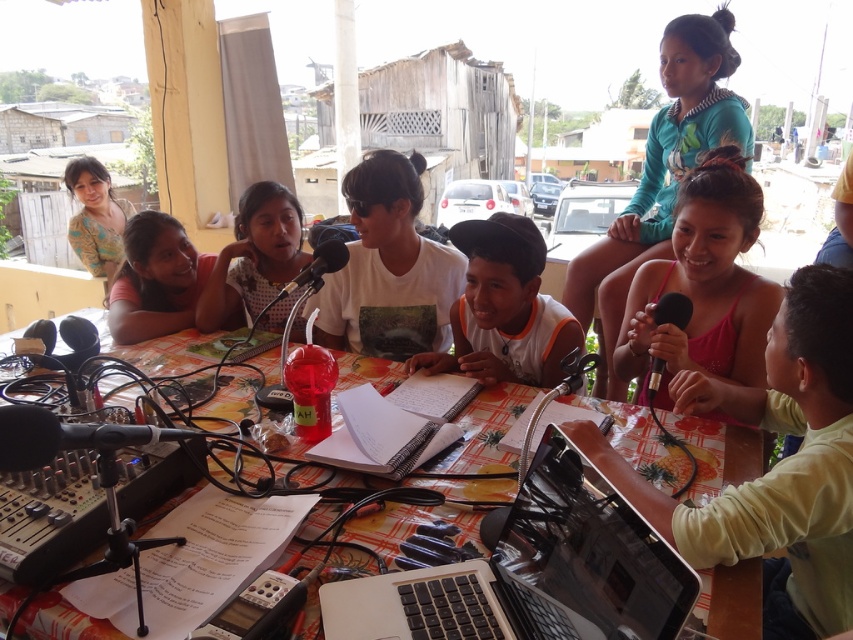
Does green fabric shirt at center appear over black matte microphone at lower left?

Actually, green fabric shirt at center is below black matte microphone at lower left.

Between green fabric shirt at center and black matte microphone at lower left, which one is positioned lower?

Positioned lower is green fabric shirt at center.

Between point (677, 401) and point (9, 460), which one is positioned in front?

Point (9, 460) is more forward.

Locate an element on the screen. The image size is (853, 640). green fabric shirt at center is located at coordinates (775, 465).

Between white matte shirt at center and black metallic microphone at center, which one has less height?

black metallic microphone at center

Can you confirm if white matte shirt at center is shorter than black metallic microphone at center?

No, white matte shirt at center is not shorter than black metallic microphone at center.

Locate an element on the screen. Image resolution: width=853 pixels, height=640 pixels. white matte shirt at center is located at coordinates (387, 268).

Does black matte microphone at lower left appear on the left side of black metallic microphone at center?

Yes, black matte microphone at lower left is to the left of black metallic microphone at center.

Does black matte microphone at lower left have a greater height compared to black metallic microphone at center?

No, black matte microphone at lower left is not taller than black metallic microphone at center.

Find the location of a particular element. The width and height of the screenshot is (853, 640). black matte microphone at lower left is located at coordinates (67, 436).

I want to click on black matte microphone at lower left, so tap(67, 436).